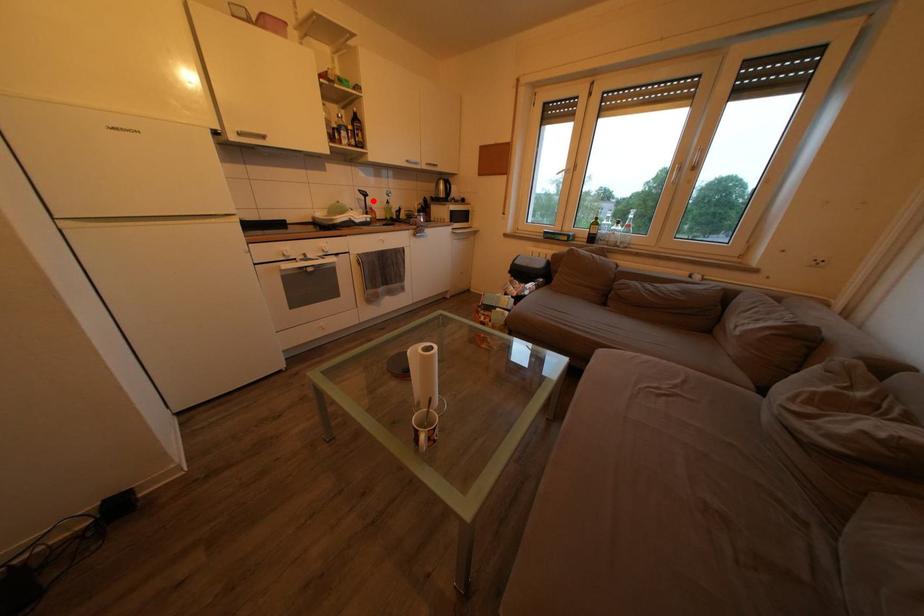
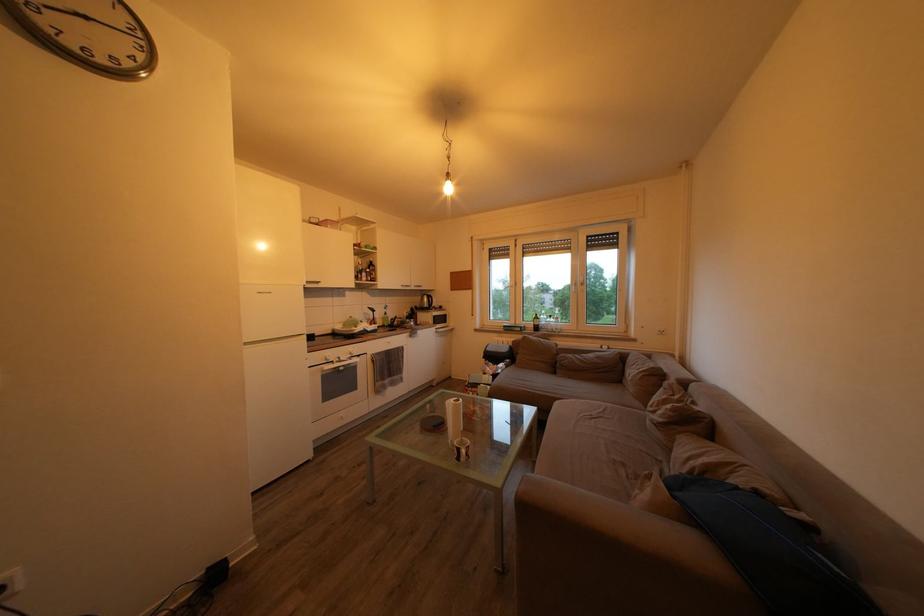
Question: I am providing you with two images of the same scene from different viewpoints. In image1, a red point is highlighted. Considering the same 3D point in image2, which of the following is correct?

Choices:
 (A) It is closer
 (B) It is farther

Answer: (B)